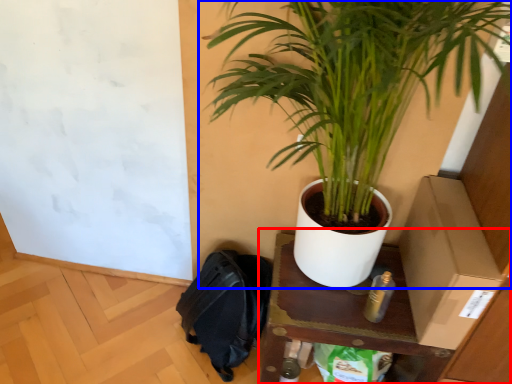
Question: Which object appears farthest to the camera in this image, table (highlighted by a red box) or houseplant (highlighted by a blue box)?

Choices:
 (A) table
 (B) houseplant

Answer: (A)